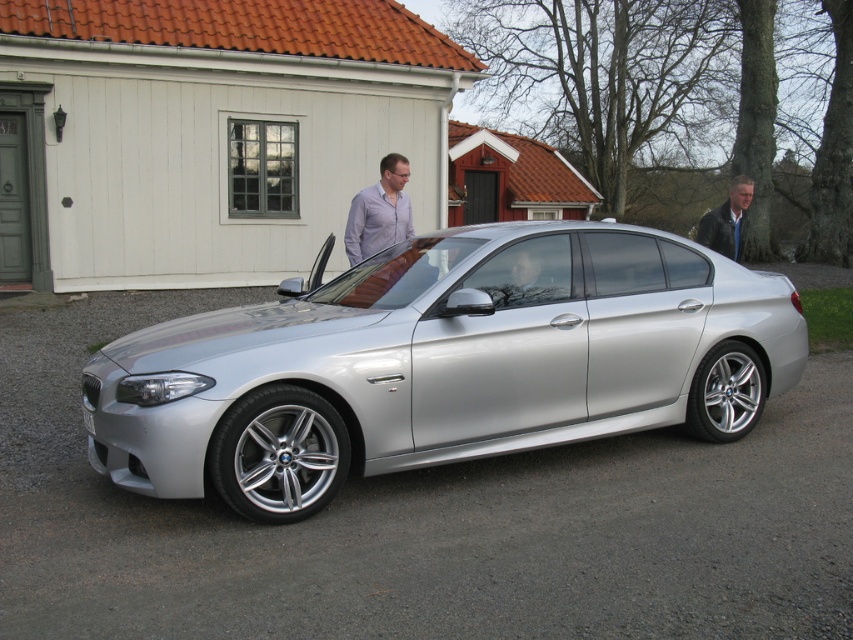
Does silver metallic car at center have a larger size compared to matte white shirt at center?

Yes, silver metallic car at center is bigger than matte white shirt at center.

In the scene shown: Between silver metallic car at center and matte white shirt at center, which one appears on the right side from the viewer's perspective?

silver metallic car at center

Which is in front, point (482, 452) or point (403, 205)?

Point (482, 452) is in front.

The width and height of the screenshot is (853, 640). I want to click on silver metallic car at center, so click(442, 364).

Which of these two, silver metallic car at center or leather jacket at right, stands shorter?

silver metallic car at center

Does point (532, 321) come in front of point (733, 241)?

That is True.

Find the location of a particular element. Image resolution: width=853 pixels, height=640 pixels. silver metallic car at center is located at coordinates (442, 364).

Does matte white shirt at center have a lesser height compared to leather jacket at right?

Yes, matte white shirt at center is shorter than leather jacket at right.

In the scene shown: Does matte white shirt at center come in front of leather jacket at right?

Yes.

Is point (383, 228) farther from camera compared to point (701, 216)?

No.

Find the location of a particular element. matte white shirt at center is located at coordinates (379, 211).